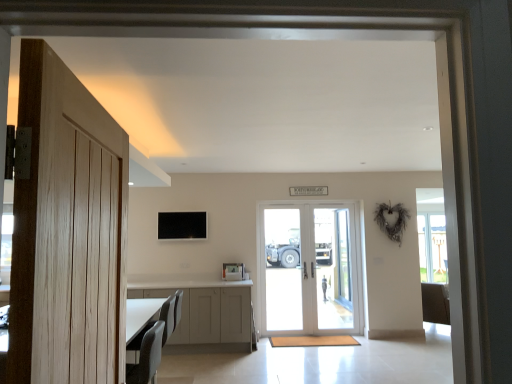
Question: Considering the relative sizes of clear glass door at center, which ranks as the 1th screen door in right-to-left order, and white glossy door at center, positioned as the 2th door in front-to-back order, in the image provided, is clear glass door at center, which ranks as the 1th screen door in right-to-left order, taller than white glossy door at center, positioned as the 2th door in front-to-back order,?

Choices:
 (A) no
 (B) yes

Answer: (A)

Question: Is clear glass door at center, the 2th screen door viewed from the left, further to camera compared to white glossy door at center, the first door from the back?

Choices:
 (A) yes
 (B) no

Answer: (A)

Question: Is clear glass door at center, which ranks as the 1th screen door in right-to-left order, completely or partially outside of white glossy door at center, the first door from the back?

Choices:
 (A) no
 (B) yes

Answer: (A)

Question: Considering the relative sizes of clear glass door at center, the 2th screen door viewed from the left, and white glossy door at center, acting as the first door starting from the right, in the image provided, is clear glass door at center, the 2th screen door viewed from the left, shorter than white glossy door at center, acting as the first door starting from the right,?

Choices:
 (A) yes
 (B) no

Answer: (A)

Question: Considering the relative positions of clear glass door at center, the 2th screen door viewed from the left, and white glossy door at center, which is the 2th door from left to right, in the image provided, is clear glass door at center, the 2th screen door viewed from the left, to the right of white glossy door at center, which is the 2th door from left to right, from the viewer's perspective?

Choices:
 (A) yes
 (B) no

Answer: (A)

Question: Is light wood door at left, the 2th door viewed from the right, inside the boundaries of white glossy door at center, which is the 2th door from left to right, or outside?

Choices:
 (A) inside
 (B) outside

Answer: (B)

Question: In terms of width, does light wood door at left, the 2th door viewed from the right, look wider or thinner when compared to white glossy door at center, positioned as the 2th door in front-to-back order?

Choices:
 (A) wide
 (B) thin

Answer: (A)

Question: Considering their positions, is light wood door at left, the 2th door viewed from the right, located in front of or behind white glossy door at center, which is the 2th door from left to right?

Choices:
 (A) front
 (B) behind

Answer: (A)

Question: From a real-world perspective, relative to white glossy door at center, positioned as the 2th door in front-to-back order, is light wood door at left, which is counted as the 2th door, starting from the back, vertically above or below?

Choices:
 (A) above
 (B) below

Answer: (A)

Question: From a real-world perspective, is clear glass door at center, which ranks as the 1th screen door in right-to-left order, physically located above or below white glossy door at center, which is the 2th door from left to right?

Choices:
 (A) below
 (B) above

Answer: (A)

Question: Looking at their shapes, would you say clear glass door at center, the 2th screen door viewed from the left, is wider or thinner than white glossy door at center, acting as the first door starting from the right?

Choices:
 (A) thin
 (B) wide

Answer: (B)

Question: From the image's perspective, is clear glass door at center, which ranks as the 1th screen door in right-to-left order, above or below white glossy door at center, the first door from the back?

Choices:
 (A) below
 (B) above

Answer: (A)

Question: Would you say clear glass door at center, the 2th screen door viewed from the left, is to the left or to the right of white glossy door at center, the first door from the back, in the picture?

Choices:
 (A) left
 (B) right

Answer: (B)

Question: Considering the positions of matte gray chair at lower left and light wood door at left, which is the 1th door in front-to-back order, in the image, is matte gray chair at lower left wider or thinner than light wood door at left, which is the 1th door in front-to-back order,?

Choices:
 (A) wide
 (B) thin

Answer: (A)

Question: Is matte gray chair at lower left inside the boundaries of light wood door at left, which is counted as the 2th door, starting from the back, or outside?

Choices:
 (A) outside
 (B) inside

Answer: (A)